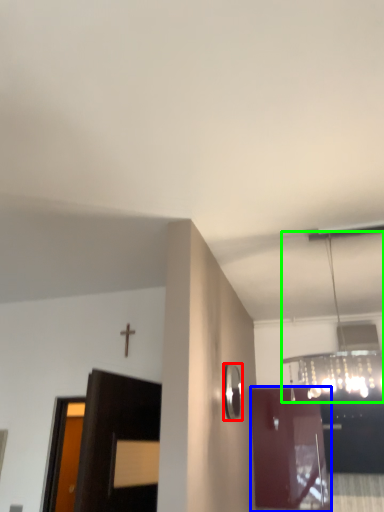
Question: Based on their relative distances, which object is nearer to mirror (highlighted by a red box)? Choose from door (highlighted by a blue box) and light fixture (highlighted by a green box).

Choices:
 (A) door
 (B) light fixture

Answer: (B)